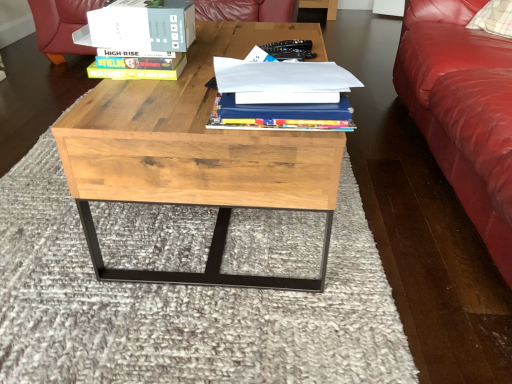
The height and width of the screenshot is (384, 512). Identify the location of vacant area that lies in front of hardcover book at upper left. (133, 98).